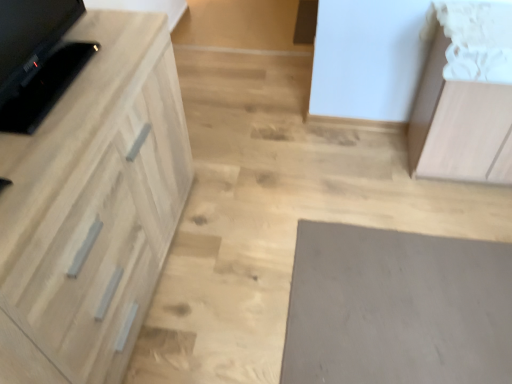
Where is `vacant space to the left of gray matte mat at lower right`? The image size is (512, 384). vacant space to the left of gray matte mat at lower right is located at coordinates (225, 280).